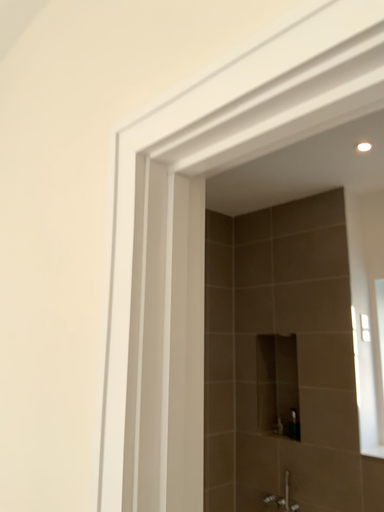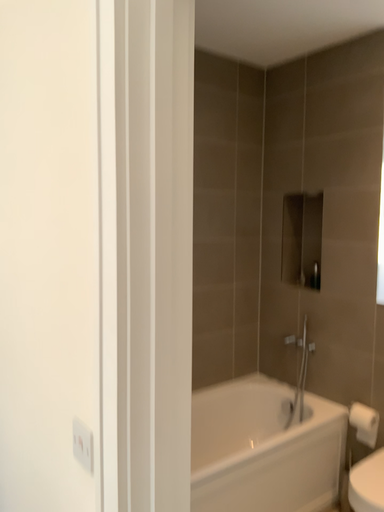
Question: Which way did the camera rotate in the video?

Choices:
 (A) rotated downward
 (B) rotated upward

Answer: (A)